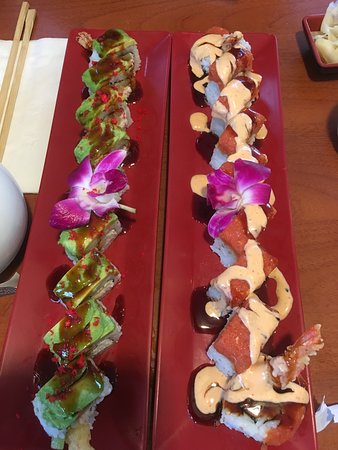
What are the coordinates of `left flower` in the screenshot? It's located at (98, 193).